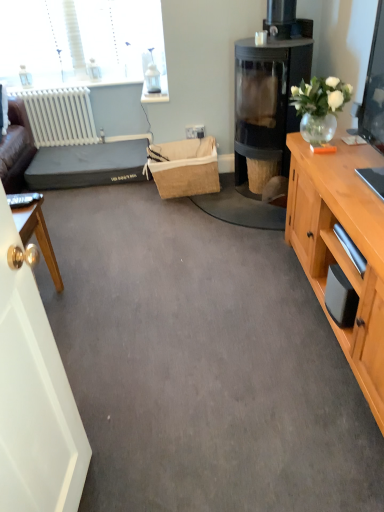
Where is `vacant space to the right of polished wood desk at left`? The width and height of the screenshot is (384, 512). vacant space to the right of polished wood desk at left is located at coordinates (98, 302).